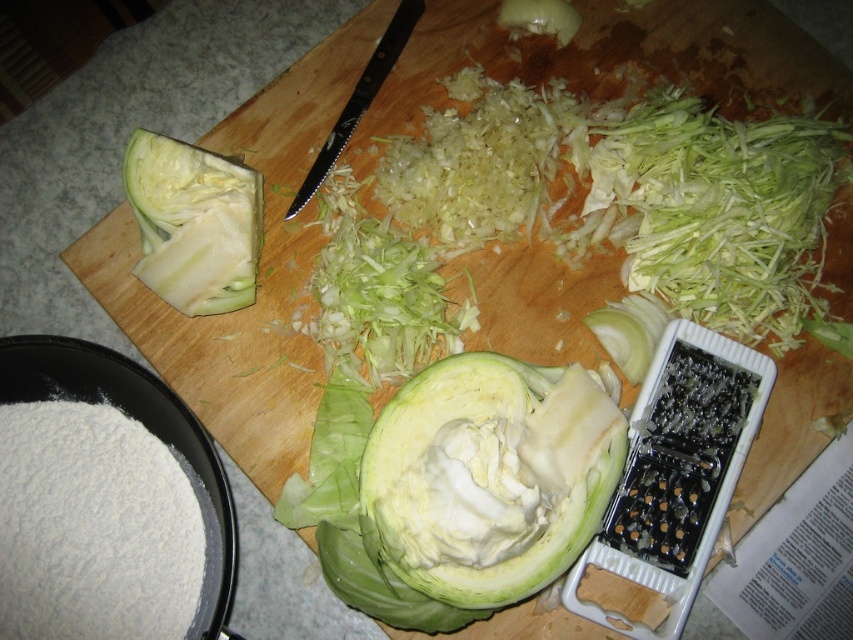
Which is in front, point (183, 296) or point (329, 132)?

Point (183, 296) is more forward.

Which is behind, point (172, 138) or point (380, 58)?

The point (380, 58) is behind.

Locate an element on the screen. The width and height of the screenshot is (853, 640). white crisp cabbage at upper left is located at coordinates (193, 224).

Does green crisp cabbage at center have a greater width compared to green leafy vegetable at upper center?

Indeed, green crisp cabbage at center has a greater width compared to green leafy vegetable at upper center.

Does point (374, 456) come closer to viewer compared to point (561, 33)?

Yes.

Locate an element on the screen. green crisp cabbage at center is located at coordinates (490, 476).

Consider the image. Does black plastic knife at upper center appear under green leafy vegetable at upper center?

Indeed, black plastic knife at upper center is positioned under green leafy vegetable at upper center.

Does black plastic knife at upper center appear on the left side of green leafy vegetable at upper center?

Indeed, black plastic knife at upper center is positioned on the left side of green leafy vegetable at upper center.

What do you see at coordinates (358, 99) in the screenshot?
I see `black plastic knife at upper center` at bounding box center [358, 99].

Locate an element on the screen. The width and height of the screenshot is (853, 640). black plastic knife at upper center is located at coordinates click(358, 99).